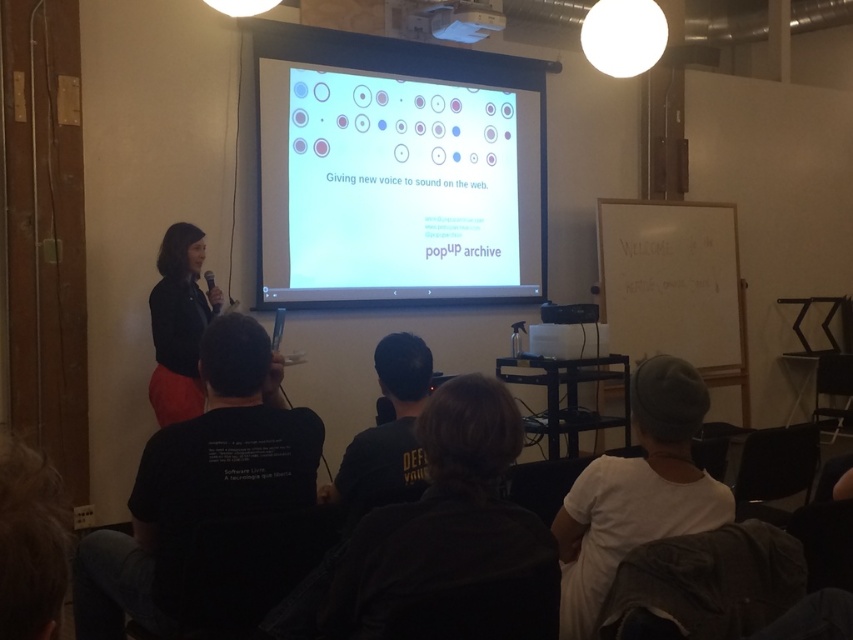
Question: Is white matte projection screen at center in front of black cotton t-shirt at lower left?

Choices:
 (A) yes
 (B) no

Answer: (B)

Question: Is black cotton t-shirt at lower left behind black cotton shirt at center?

Choices:
 (A) yes
 (B) no

Answer: (B)

Question: Which is farther from the matte black jacket at left?

Choices:
 (A) black cotton t-shirt at lower left
 (B) white matte projection screen at center
 (C) black cotton shirt at center

Answer: (C)

Question: Which point appears closest to the camera in this image?

Choices:
 (A) (660, 378)
 (B) (201, 385)
 (C) (358, 58)

Answer: (A)

Question: Can you confirm if black cotton t-shirt at lower left is bigger than white cotton shirt at lower right?

Choices:
 (A) no
 (B) yes

Answer: (B)

Question: Which point is farther to the camera?

Choices:
 (A) pyautogui.click(x=262, y=256)
 (B) pyautogui.click(x=479, y=26)

Answer: (B)